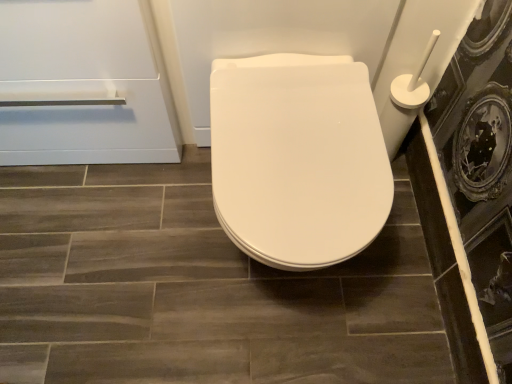
Question: Does matte ceramic tile at center appear on the left side of transparent glass screen door at right?

Choices:
 (A) yes
 (B) no

Answer: (A)

Question: Is matte ceramic tile at center oriented away from transparent glass screen door at right?

Choices:
 (A) yes
 (B) no

Answer: (B)

Question: Does matte ceramic tile at center have a greater width compared to transparent glass screen door at right?

Choices:
 (A) yes
 (B) no

Answer: (A)

Question: Is transparent glass screen door at right located within matte ceramic tile at center?

Choices:
 (A) yes
 (B) no

Answer: (B)

Question: Is matte ceramic tile at center further to the viewer compared to transparent glass screen door at right?

Choices:
 (A) yes
 (B) no

Answer: (A)

Question: Based on their positions, is white glossy toilet seat at center located to the left or right of matte ceramic tile at center?

Choices:
 (A) right
 (B) left

Answer: (A)

Question: Relative to matte ceramic tile at center, is white glossy toilet seat at center in front or behind?

Choices:
 (A) behind
 (B) front

Answer: (B)

Question: From a real-world perspective, is white glossy toilet seat at center positioned above or below matte ceramic tile at center?

Choices:
 (A) above
 (B) below

Answer: (A)

Question: Considering the positions of white glossy toilet seat at center and matte ceramic tile at center in the image, is white glossy toilet seat at center wider or thinner than matte ceramic tile at center?

Choices:
 (A) thin
 (B) wide

Answer: (A)

Question: Is transparent glass screen door at right to the left or to the right of matte ceramic tile at center in the image?

Choices:
 (A) right
 (B) left

Answer: (A)

Question: From a real-world perspective, is transparent glass screen door at right positioned above or below matte ceramic tile at center?

Choices:
 (A) below
 (B) above

Answer: (B)

Question: From the image's perspective, is transparent glass screen door at right located above or below matte ceramic tile at center?

Choices:
 (A) above
 (B) below

Answer: (A)

Question: Choose the correct answer: Is transparent glass screen door at right inside matte ceramic tile at center or outside it?

Choices:
 (A) outside
 (B) inside

Answer: (A)

Question: Looking at their shapes, would you say matte ceramic tile at center is wider or thinner than white glossy toilet seat at center?

Choices:
 (A) thin
 (B) wide

Answer: (B)

Question: In terms of height, does matte ceramic tile at center look taller or shorter compared to white glossy toilet seat at center?

Choices:
 (A) short
 (B) tall

Answer: (A)